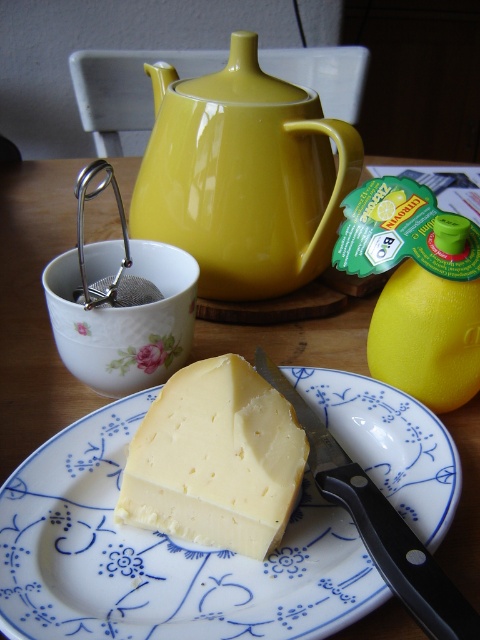
Question: Considering the relative positions of yellow cheese at center and black plastic knife at lower center in the image provided, where is yellow cheese at center located with respect to black plastic knife at lower center?

Choices:
 (A) left
 (B) right

Answer: (A)

Question: Which object is positioned closest to the yellow smooth cheese at center?

Choices:
 (A) yellow cheese at center
 (B) glossy ceramic teapot at upper center

Answer: (A)

Question: Which is farther from the glossy ceramic teapot at upper center?

Choices:
 (A) yellow smooth cheese at center
 (B) yellow cheese at center

Answer: (A)

Question: Is yellow cheese at center above black plastic knife at lower center?

Choices:
 (A) no
 (B) yes

Answer: (A)

Question: Which of the following is the farthest from the observer?

Choices:
 (A) (163, 163)
 (B) (80, 566)
 (C) (384, 545)

Answer: (A)

Question: Does yellow cheese at center appear on the left side of black plastic knife at lower center?

Choices:
 (A) yes
 (B) no

Answer: (A)